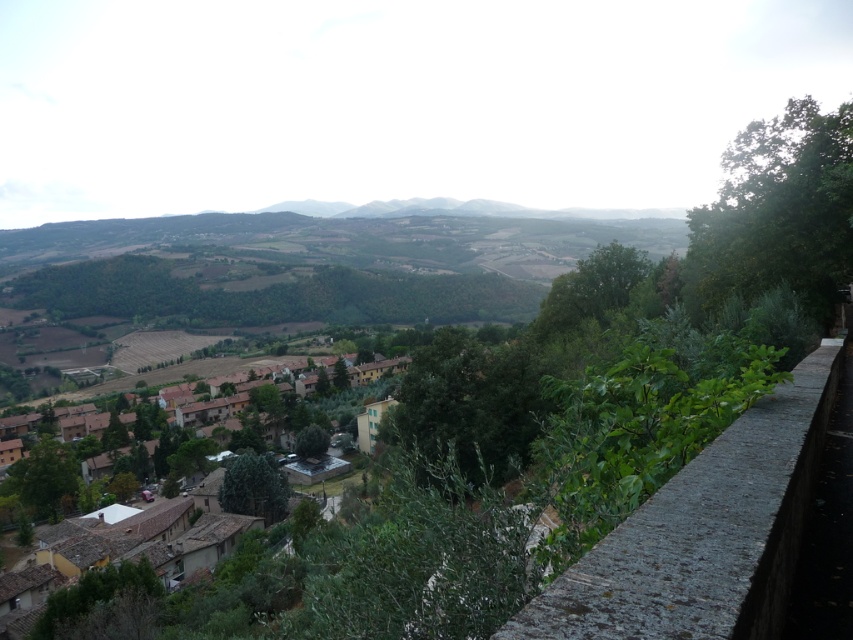
Is the position of gray stone ledge at right less distant than that of brown tiled roofs at lower center?

Yes.

Looking at this image, can you confirm if gray stone ledge at right is taller than brown tiled roofs at lower center?

Incorrect, gray stone ledge at right's height is not larger of brown tiled roofs at lower center's.

Does point (585, 618) come behind point (253, 557)?

No.

Image resolution: width=853 pixels, height=640 pixels. In order to click on gray stone ledge at right in this screenshot , I will do `click(705, 532)`.